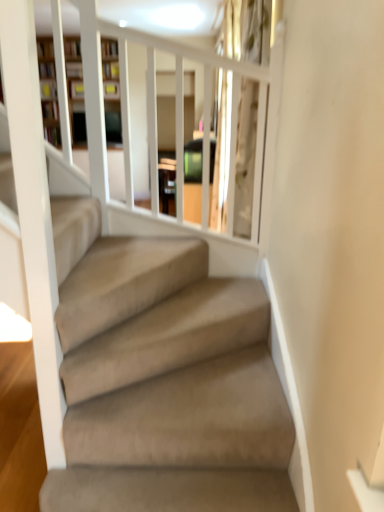
Question: Based on their positions, is wooden bookshelf at upper left located to the left or right of clear glass door at upper center?

Choices:
 (A) left
 (B) right

Answer: (A)

Question: Looking at their shapes, would you say wooden bookshelf at upper left is wider or thinner than clear glass door at upper center?

Choices:
 (A) thin
 (B) wide

Answer: (B)

Question: Considering the positions of wooden bookshelf at upper left and clear glass door at upper center in the image, is wooden bookshelf at upper left taller or shorter than clear glass door at upper center?

Choices:
 (A) short
 (B) tall

Answer: (B)

Question: From the image's perspective, is clear glass door at upper center above or below wooden bookshelf at upper left?

Choices:
 (A) above
 (B) below

Answer: (B)

Question: Does point (261, 22) appear closer or farther from the camera than point (74, 70)?

Choices:
 (A) closer
 (B) farther

Answer: (A)

Question: In terms of width, does clear glass door at upper center look wider or thinner when compared to wooden bookshelf at upper left?

Choices:
 (A) thin
 (B) wide

Answer: (A)

Question: Visually, is clear glass door at upper center positioned to the left or to the right of wooden bookshelf at upper left?

Choices:
 (A) left
 (B) right

Answer: (B)